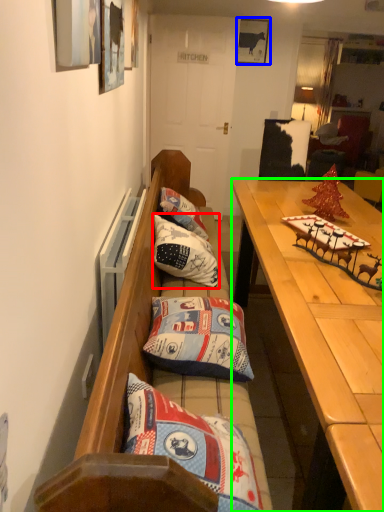
Question: Estimate the real-world distances between objects in this image. Which object is closer to pillow (highlighted by a red box), picture frame (highlighted by a blue box) or desk (highlighted by a green box)?

Choices:
 (A) picture frame
 (B) desk

Answer: (B)